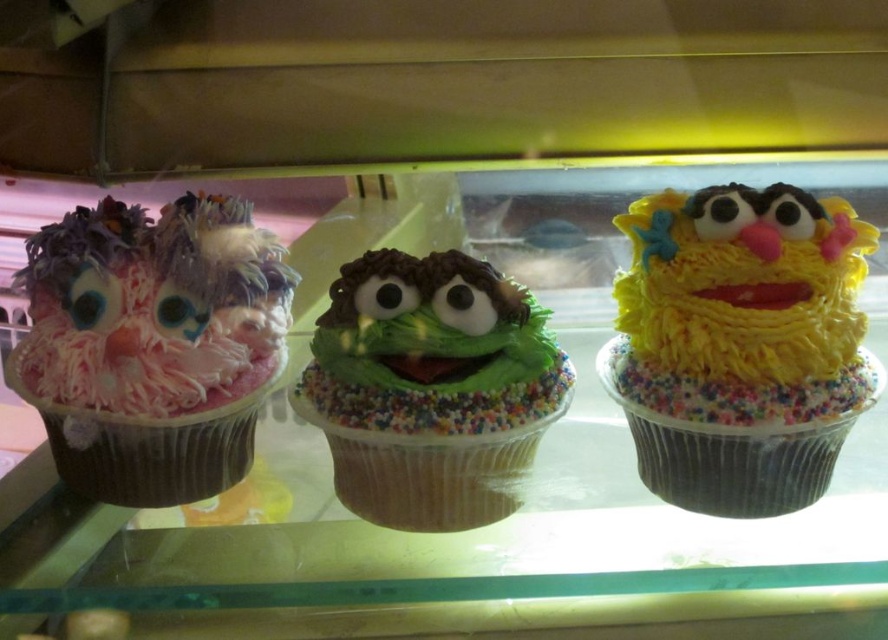
Question: Can you confirm if pink fluffy cupcake at left is thinner than green frosted cupcake at center?

Choices:
 (A) no
 (B) yes

Answer: (B)

Question: Does yellow frosting cupcake at center appear under pink fluffy cupcake at left?

Choices:
 (A) no
 (B) yes

Answer: (B)

Question: Estimate the real-world distances between objects in this image. Which object is farther from the pink fluffy cupcake at left?

Choices:
 (A) yellow frosting cupcake at center
 (B) green frosted cupcake at center

Answer: (A)

Question: Is pink fluffy cupcake at left further to camera compared to green frosted cupcake at center?

Choices:
 (A) no
 (B) yes

Answer: (A)

Question: Which point is closer to the camera?

Choices:
 (A) yellow frosting cupcake at center
 (B) pink fluffy cupcake at left

Answer: (A)

Question: Which of the following is the farthest from the observer?

Choices:
 (A) (403, 451)
 (B) (217, 362)

Answer: (B)